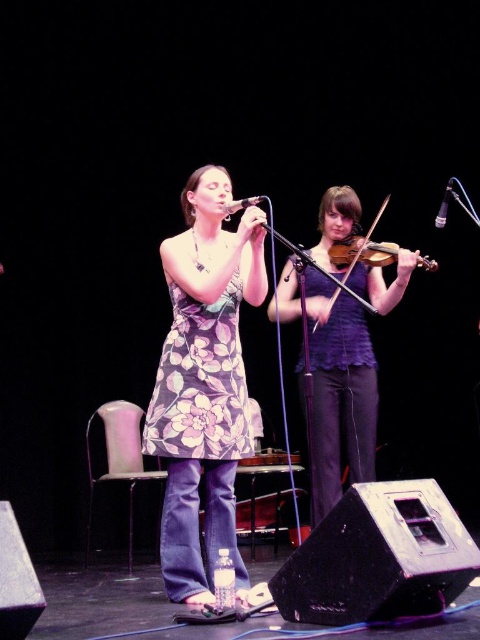
You are a photographer at the back of the stage trying to capture both the purple textured top at center and the wooden violin at center in a single shot. Which object should you adjust your camera focus towards to ensure both are in frame?

The purple textured top at center is positioned on the left side of wooden violin at center, so you should adjust your camera focus to include both the left and right sides of the central area where they are located.